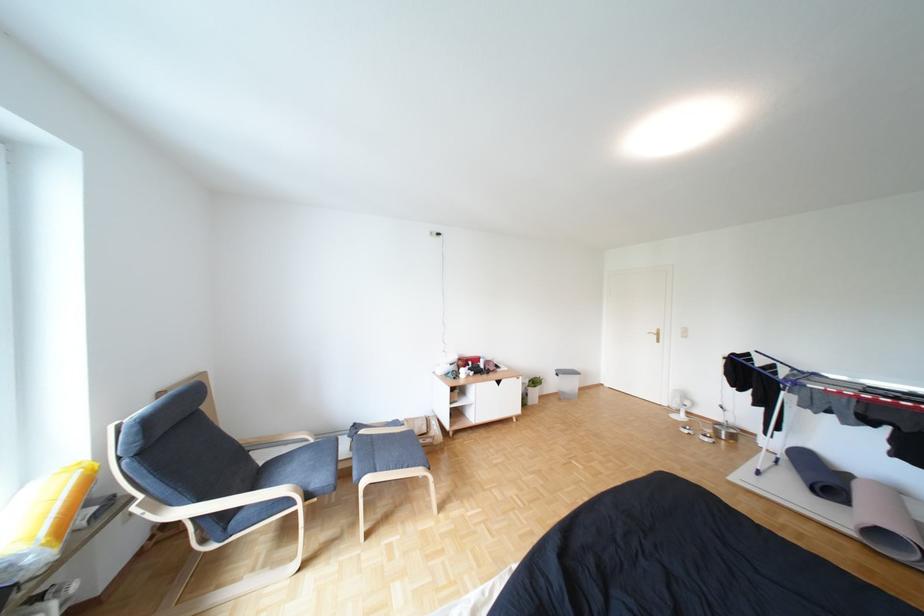
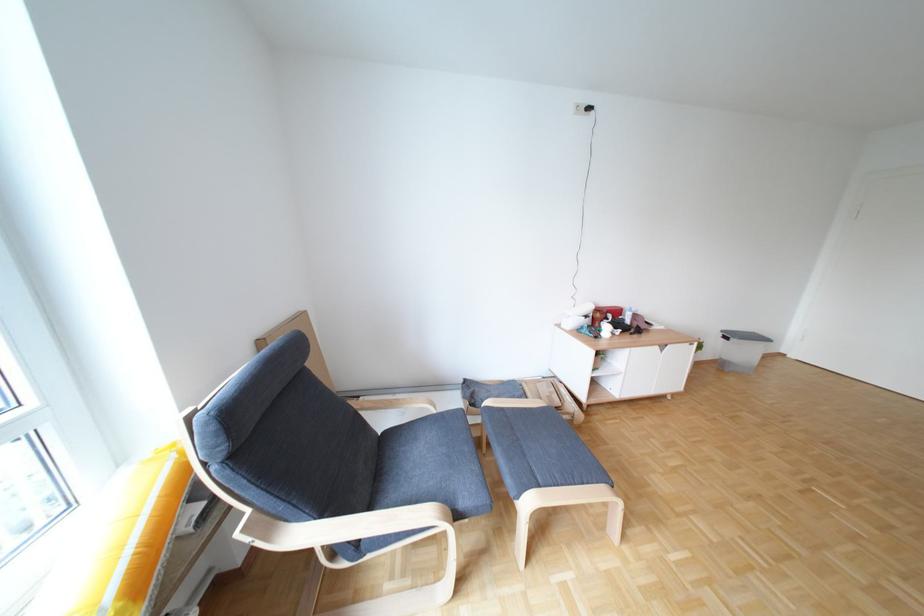
Where in the second image is the point corresponding to pixel 476 363 from the first image?

(614, 315)